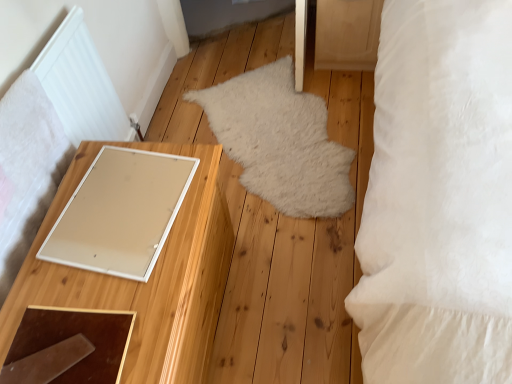
This screenshot has height=384, width=512. What are the coordinates of `vacant area that is situated to the right of white matte mirror at left` in the screenshot? It's located at (279, 280).